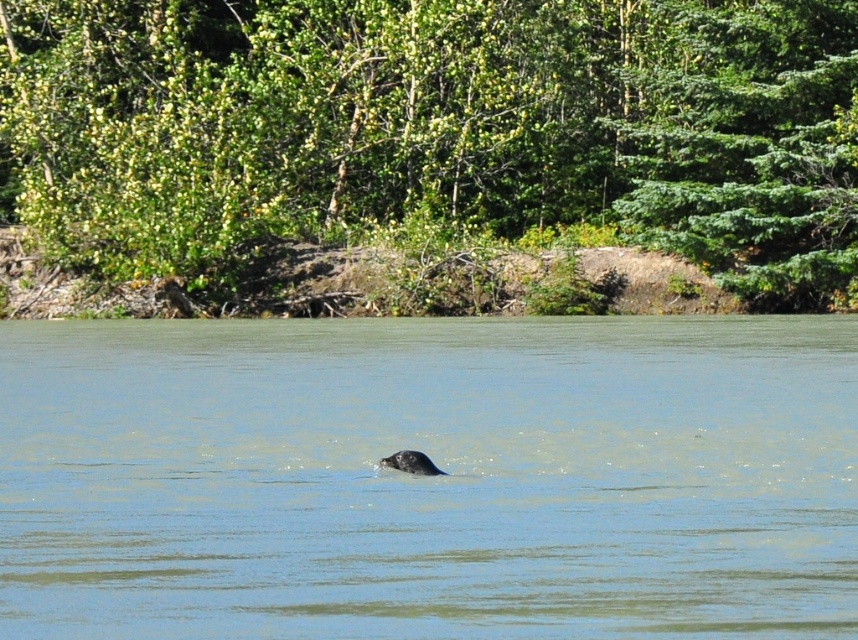
Question: Is green leafy tree at upper center smaller than green leafy tree at upper right?

Choices:
 (A) no
 (B) yes

Answer: (A)

Question: Can you confirm if green leafy tree at upper right is positioned to the right of gray fur seal at center?

Choices:
 (A) yes
 (B) no

Answer: (A)

Question: Is green leafy tree at upper center below green leafy tree at upper right?

Choices:
 (A) yes
 (B) no

Answer: (B)

Question: Estimate the real-world distances between objects in this image. Which object is farther from the green leafy tree at upper center?

Choices:
 (A) clear water at center
 (B) gray fur seal at center
 (C) green leafy tree at upper right

Answer: (B)

Question: Which point is farther to the camera?

Choices:
 (A) green leafy tree at upper right
 (B) clear water at center
 (C) gray fur seal at center

Answer: (A)

Question: Which point is farther from the camera taking this photo?

Choices:
 (A) (331, 88)
 (B) (744, 221)

Answer: (A)